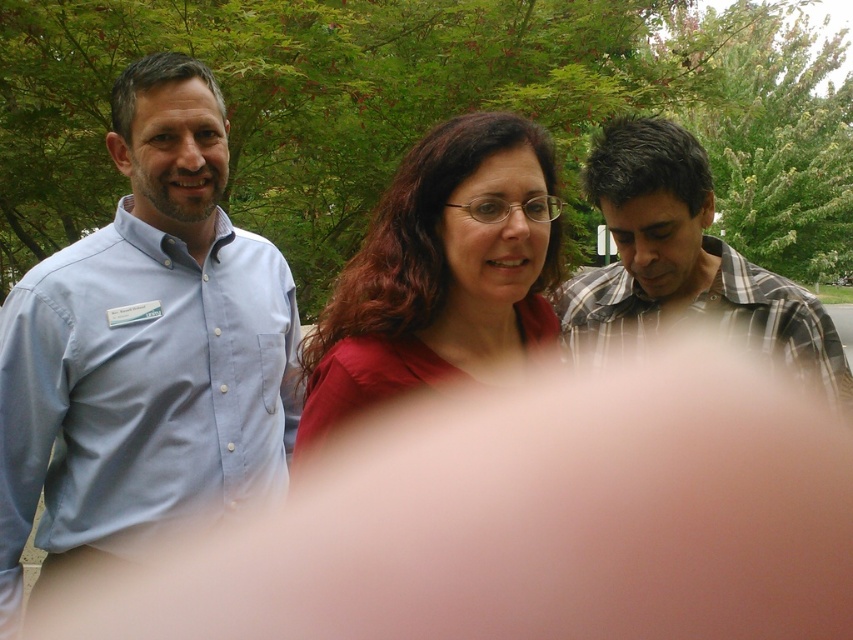
What color is the shirt located at point (440, 273)?

The shirt at point (440, 273) is matte red.

You are taking a photo of the scene and want to focus on both point (x=273, y=464) and point (x=614, y=227). Which point is closer to your camera?

Point (x=273, y=464) is further to the camera than point (x=614, y=227), so point (x=614, y=227) is closer to the camera.